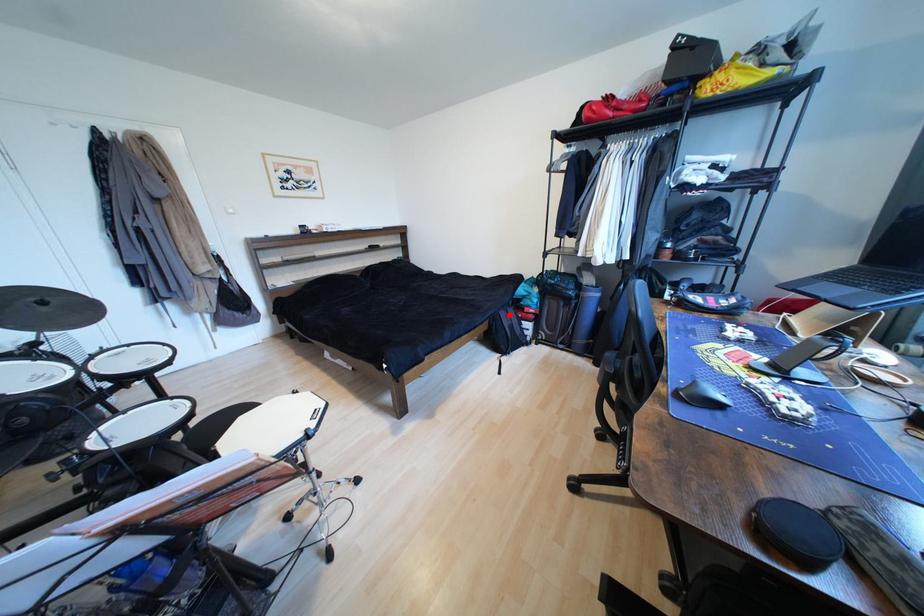
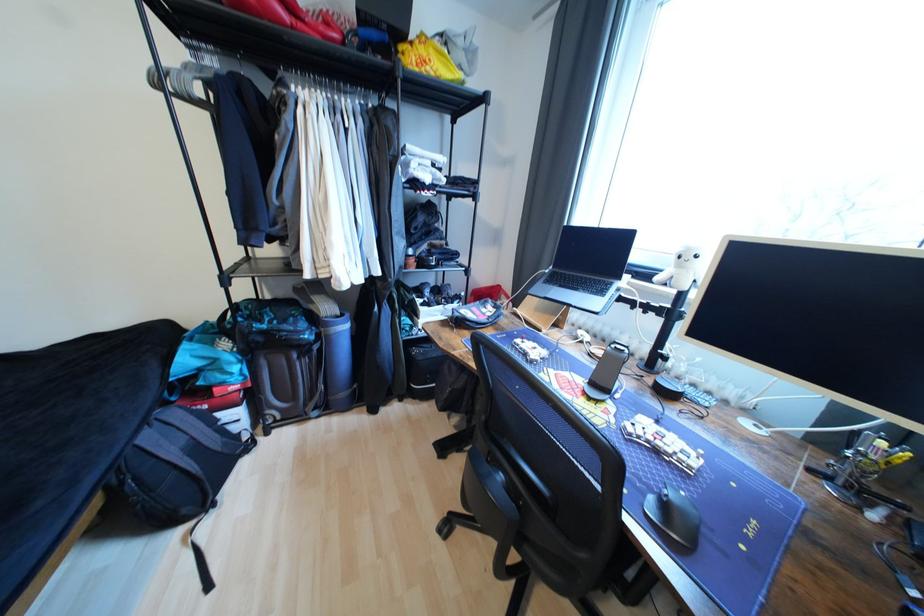
In the second image, find the point that corresponds to the highlighted location in the first image.

(155, 439)